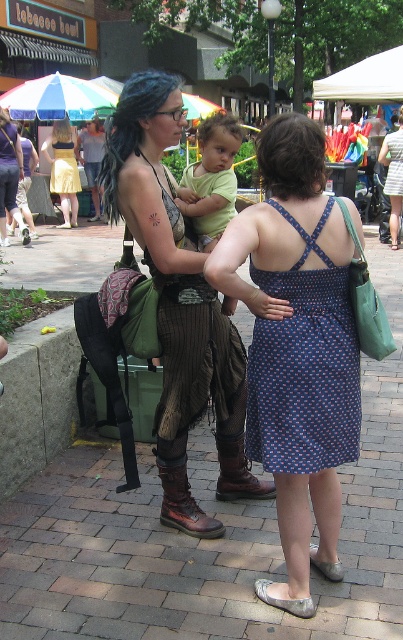
Is leather boots at center above light green fabric shirt at center?

Actually, leather boots at center is below light green fabric shirt at center.

I want to click on leather boots at center, so click(x=178, y=305).

The width and height of the screenshot is (403, 640). I want to click on leather boots at center, so click(x=178, y=305).

Is blue dyed hair at center positioned before dark brown curly hair at center?

Yes, it is in front of dark brown curly hair at center.

Does blue dyed hair at center appear over dark brown curly hair at center?

Indeed, blue dyed hair at center is positioned over dark brown curly hair at center.

Describe the element at coordinates (130, 128) in the screenshot. This screenshot has width=403, height=640. I see `blue dyed hair at center` at that location.

Where is `blue dyed hair at center`? blue dyed hair at center is located at coordinates (130, 128).

Measure the distance between blue dotted dress at center and light green fabric shirt at center.

blue dotted dress at center and light green fabric shirt at center are 35.37 inches apart.

Locate an element on the screen. blue dotted dress at center is located at coordinates (297, 348).